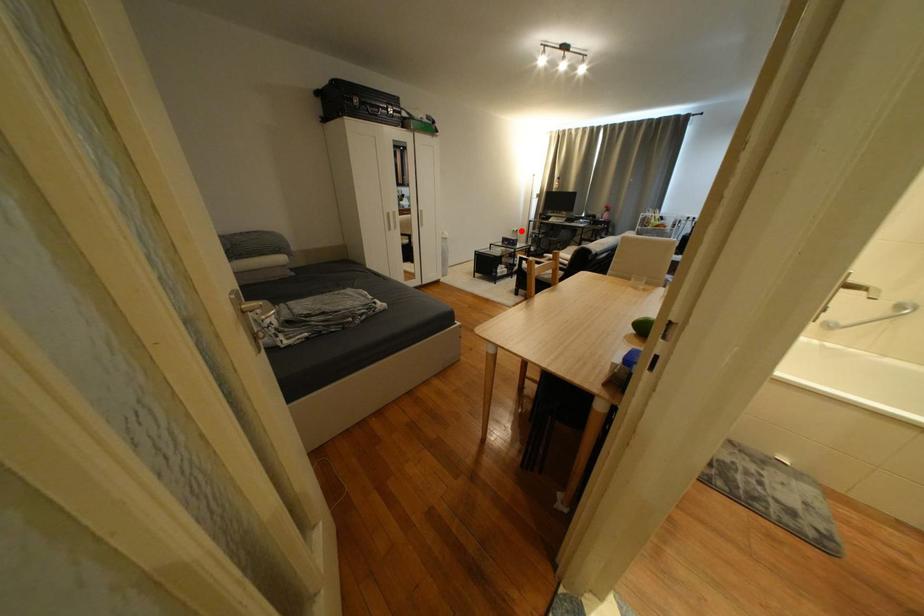
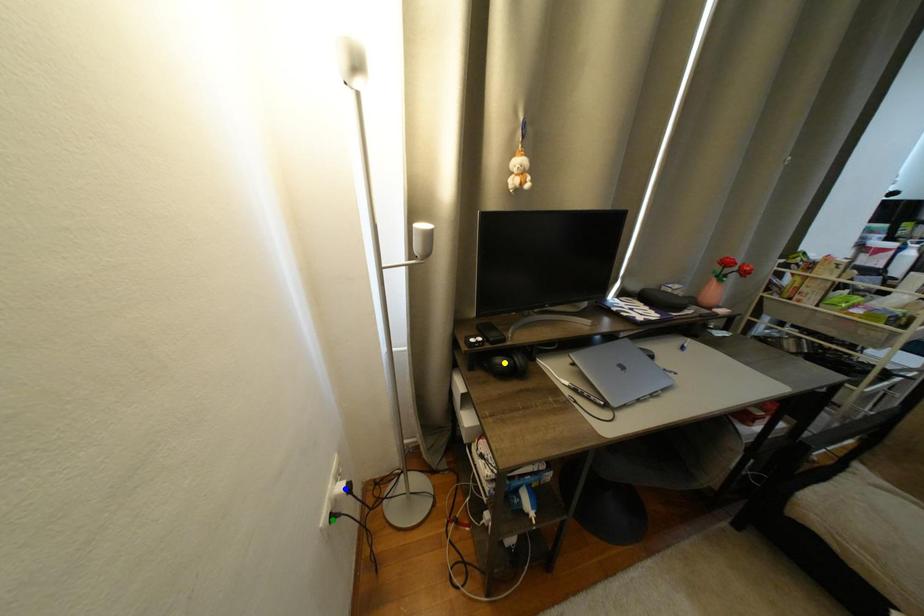
Question: I am providing you with two images of the same scene from different viewpoints. A red point is marked on the first image. You are given multiple points on the second image. Which point in image 2 represents the same 3d spot as the red point in image 1?

Choices:
 (A) blue point
 (B) green point
 (C) yellow point

Answer: (B)